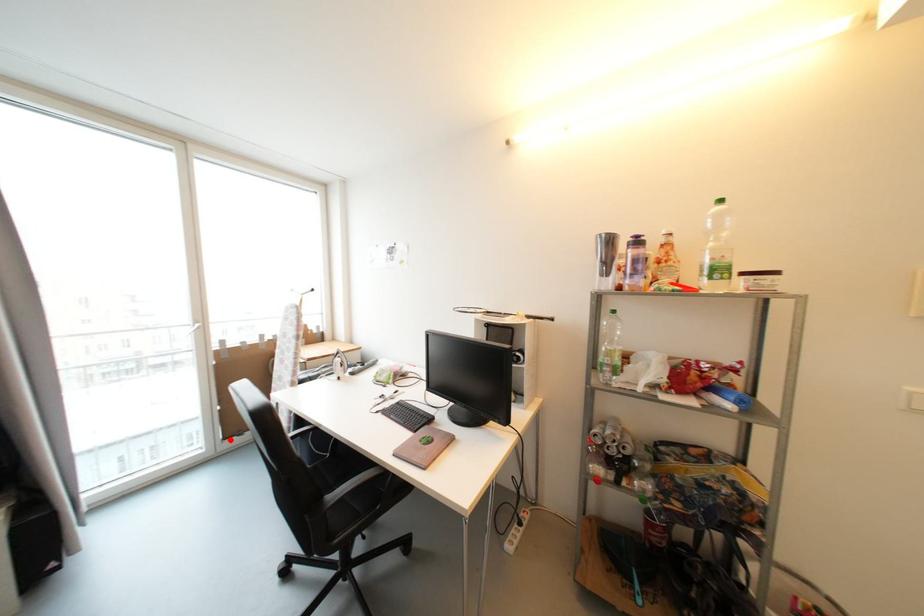
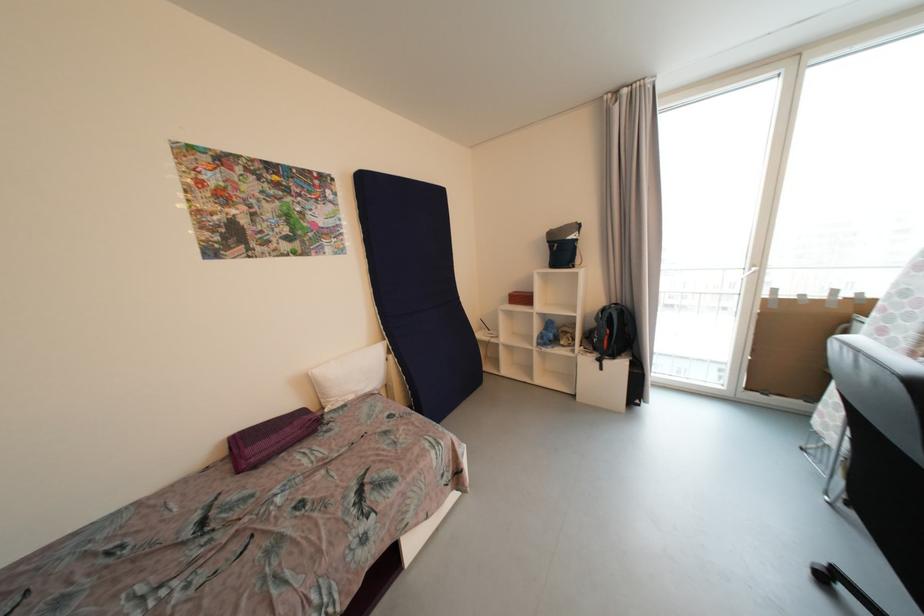
Locate, in the second image, the point that corresponds to the highlighted location in the first image.

(752, 390)